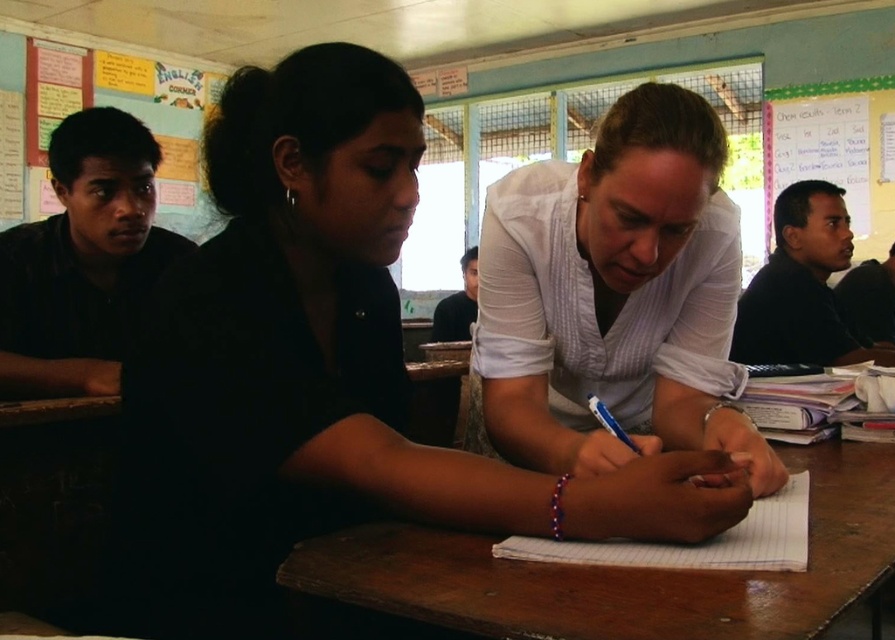
Looking at this image, you are a student who needs to hand in an assignment. You see the white striped shirt at center and the wooden table at center. Which object is closer to the left side of the room?

The white striped shirt at center is positioned on the left side of the wooden table at center, so it is closer to the left side of the room.

You are a student in the classroom and need to decide which shirt to wear for a presentation. The white matte shirt at center is part of the teacher, and the white striped shirt at center belongs to the student. Considering the size difference, which shirt would be more appropriate for a presentation requiring a professional look?

The white matte shirt at center is bigger than the white striped shirt at center, so the white matte shirt at center would be more appropriate for a professional presentation as it is larger and likely more formal.